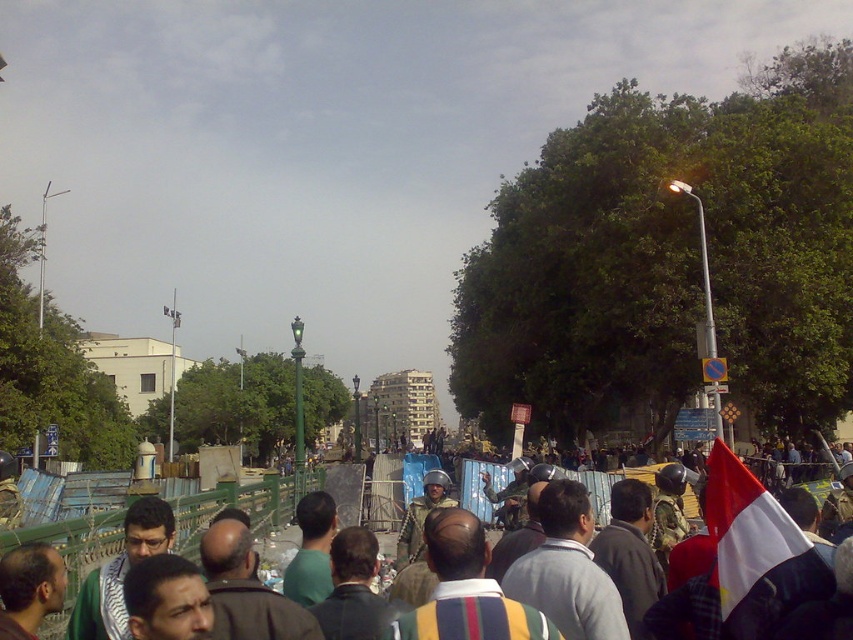
Question: Which point appears farthest from the camera in this image?

Choices:
 (A) [746, 573]
 (B) [82, 528]
 (C) [177, 326]

Answer: (C)

Question: Can you confirm if striped shirt at center is positioned to the right of white fabric flag at right?

Choices:
 (A) yes
 (B) no

Answer: (B)

Question: Among these objects, which one is farthest from the camera?

Choices:
 (A) white fabric flag at upper center
 (B) striped shirt at center
 (C) white fabric flag at right

Answer: (A)

Question: Where is white fabric flag at right located in relation to white fabric flag at upper center in the image?

Choices:
 (A) left
 (B) right

Answer: (B)

Question: Is white fabric flag at right bigger than white fabric flag at upper center?

Choices:
 (A) no
 (B) yes

Answer: (A)

Question: Which of the following is the farthest from the observer?

Choices:
 (A) (x=254, y=531)
 (B) (x=753, y=513)
 (C) (x=172, y=326)

Answer: (C)